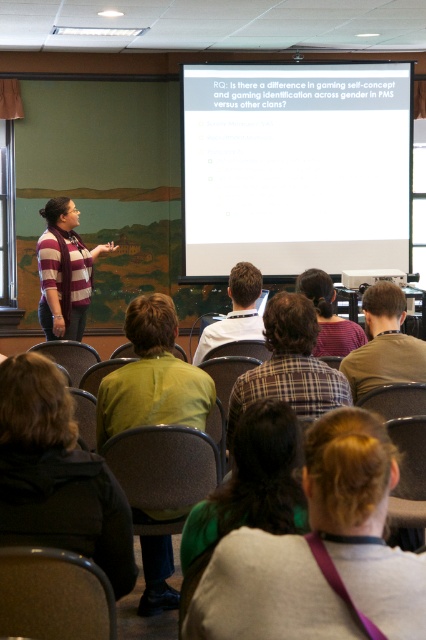
You are sitting in the audience and want to take a photo of both the white matte projection screen at upper center and the brown plaid shirt at center. Which object should you frame first in your camera to ensure both are visible in the photo?

You should frame the white matte projection screen at upper center first because its width is larger than the brown plaid shirt at center, so it requires more space in the frame to capture both objects.

You are sitting in the back row of the classroom and want to know if the person in the brown plaid shirt at center is the same individual as the one with light brown hair at center. Can you confirm if they are the same person based on their proximity?

The brown plaid shirt at center and light brown hair at center are 38.87 inches apart from each other, so they are likely not the same person since the distance between them is significant.

You are sitting in the back row of the classroom and want to see the person wearing the plaid shirt at center and the matte black projector at center. Which one is closer to you?

The plaid shirt at center is in front of the matte black projector at center, so the plaid shirt at center is closer to you.